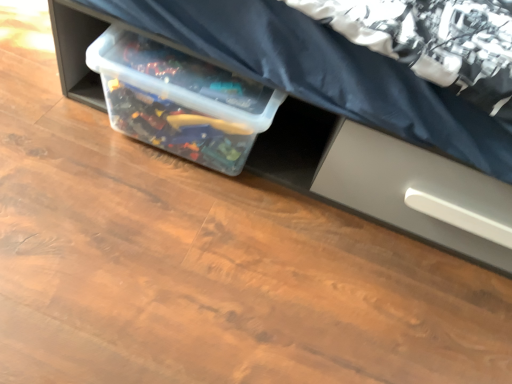
Question: Is clear plastic storage bin at center wider than transparent plastic container at center?

Choices:
 (A) no
 (B) yes

Answer: (B)

Question: Is clear plastic storage bin at center in contact with transparent plastic container at center?

Choices:
 (A) no
 (B) yes

Answer: (A)

Question: From the image's perspective, is clear plastic storage bin at center on top of transparent plastic container at center?

Choices:
 (A) yes
 (B) no

Answer: (A)

Question: Is clear plastic storage bin at center not near transparent plastic container at center?

Choices:
 (A) no
 (B) yes

Answer: (A)

Question: Is transparent plastic container at center at the back of clear plastic storage bin at center?

Choices:
 (A) no
 (B) yes

Answer: (A)

Question: In terms of width, does clear plastic storage bin at center look wider or thinner when compared to satin gray drawer at lower right?

Choices:
 (A) wide
 (B) thin

Answer: (A)

Question: From the image's perspective, is clear plastic storage bin at center located above or below satin gray drawer at lower right?

Choices:
 (A) below
 (B) above

Answer: (B)

Question: In terms of size, does clear plastic storage bin at center appear bigger or smaller than satin gray drawer at lower right?

Choices:
 (A) small
 (B) big

Answer: (B)

Question: Would you say clear plastic storage bin at center is to the left or to the right of satin gray drawer at lower right in the picture?

Choices:
 (A) right
 (B) left

Answer: (B)

Question: From a real-world perspective, is clear plastic storage bin at center positioned above or below transparent plastic container at center?

Choices:
 (A) below
 (B) above

Answer: (B)

Question: From the image's perspective, is clear plastic storage bin at center above or below transparent plastic container at center?

Choices:
 (A) below
 (B) above

Answer: (B)

Question: Is clear plastic storage bin at center wider or thinner than transparent plastic container at center?

Choices:
 (A) wide
 (B) thin

Answer: (A)

Question: Is clear plastic storage bin at center to the left or to the right of transparent plastic container at center in the image?

Choices:
 (A) left
 (B) right

Answer: (B)

Question: In the image, is transparent plastic container at center positioned in front of or behind clear plastic storage bin at center?

Choices:
 (A) front
 (B) behind

Answer: (B)

Question: Is transparent plastic container at center inside or outside of clear plastic storage bin at center?

Choices:
 (A) outside
 (B) inside

Answer: (B)